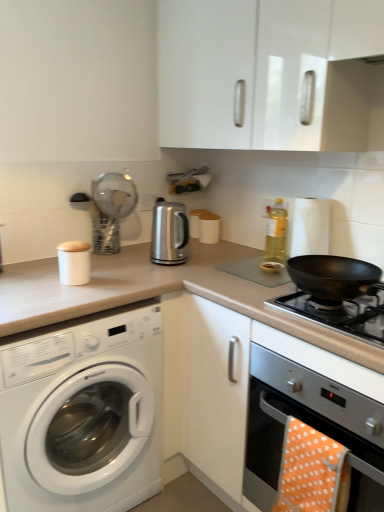
In order to click on blank space situated above beige laminate countertop at center (from a real-world perspective) in this screenshot , I will do `click(122, 263)`.